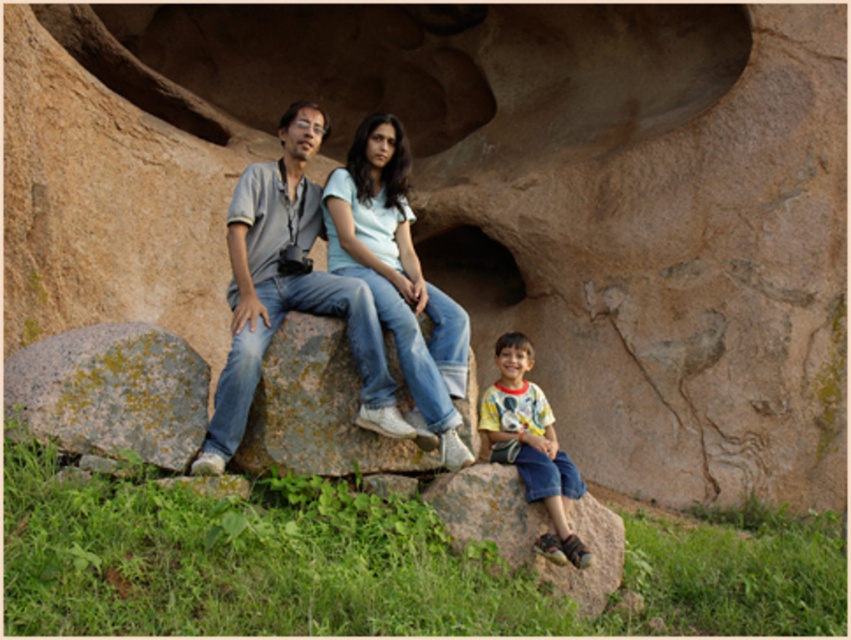
You are standing in the scene and want to walk from the denim jeans at center to the brown rough rock at lower right. Which direction should you move in?

You should move to the right to reach the brown rough rock at lower right from the denim jeans at center because the denim jeans at center is to the left of brown rough rock at lower right.